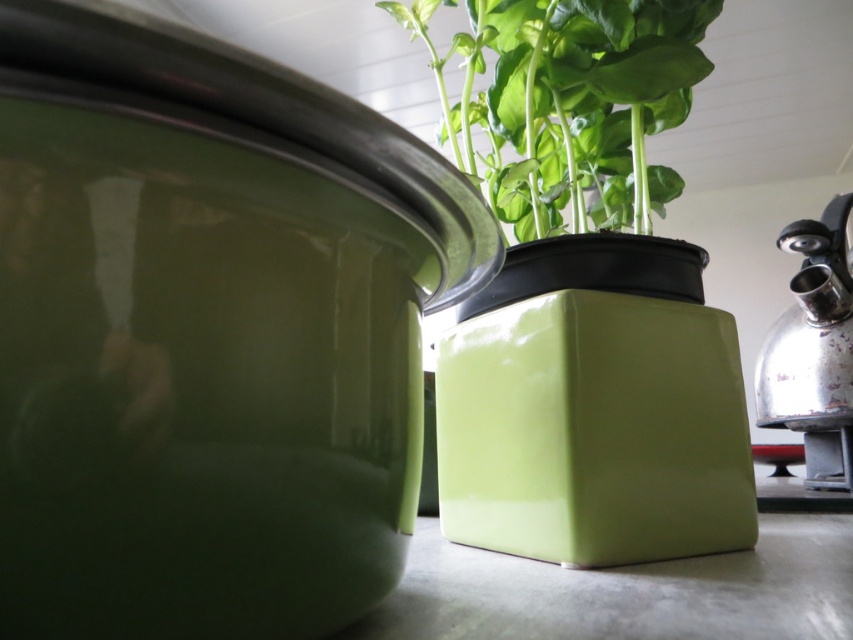
You are a barista preparing drinks and need to move the shiny metallic kettle at right to the left side of the green glossy plant at center. Is there enough space between them to slide the kettle without knocking over the plant?

The distance between the green glossy plant at center and the shiny metallic kettle at right is 16.67 inches, which should provide sufficient space to slide the kettle without knocking over the plant.

You are arranging plants on a narrow kitchen counter and have a green glossy plant at center and a shiny metallic kettle at right. Which object is closer to the left edge of the counter?

The green glossy plant at center is closer to the left edge of the counter because it is positioned to the left of the shiny metallic kettle at right.

In the scene shown: You are standing in the kitchen and see the shiny, lime green ceramic pot with a reflective surface and the black rectangular planter with a lush green plant. Where is the point at coordinates (x=569, y=104) located?

The point at coordinates (x=569, y=104) is located on the green glossy plant at center.